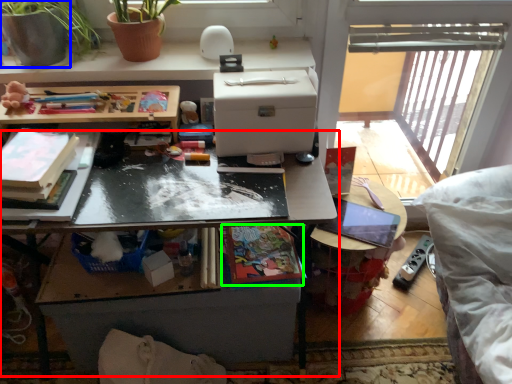
Question: Considering the real-world distances, which object is closest to table (highlighted by a red box)? flowerpot (highlighted by a blue box) or book (highlighted by a green box).

Choices:
 (A) flowerpot
 (B) book

Answer: (B)